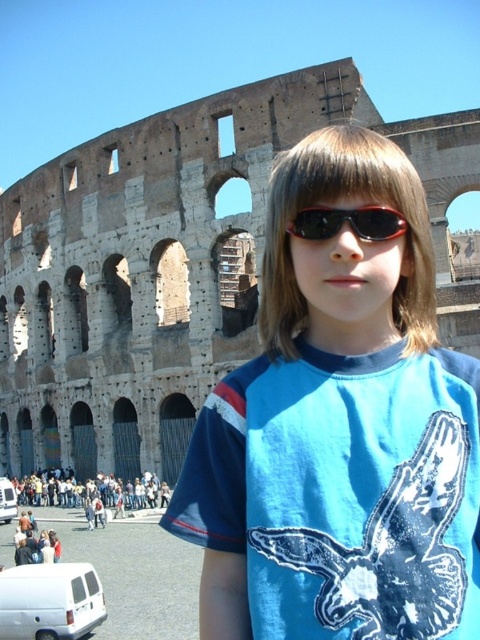
Which is below, blue cotton shirt at center or black plastic sunglasses at center?

black plastic sunglasses at center is below.

Looking at this image, between blue cotton shirt at center and black plastic sunglasses at center, which one is positioned higher?

blue cotton shirt at center

I want to click on blue cotton shirt at center, so click(x=339, y=429).

The height and width of the screenshot is (640, 480). I want to click on blue cotton shirt at center, so click(x=339, y=429).